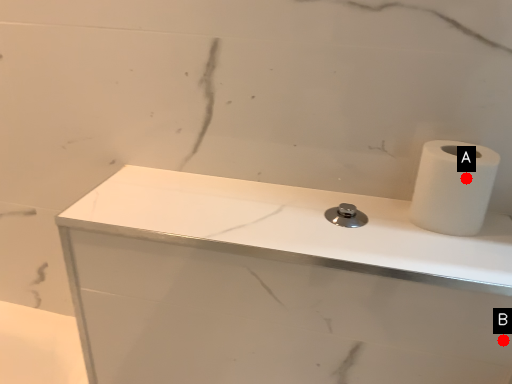
Question: Two points are circled on the image, labeled by A and B beside each circle. Among these points, which one is nearest to the camera?

Choices:
 (A) A is closer
 (B) B is closer

Answer: (B)